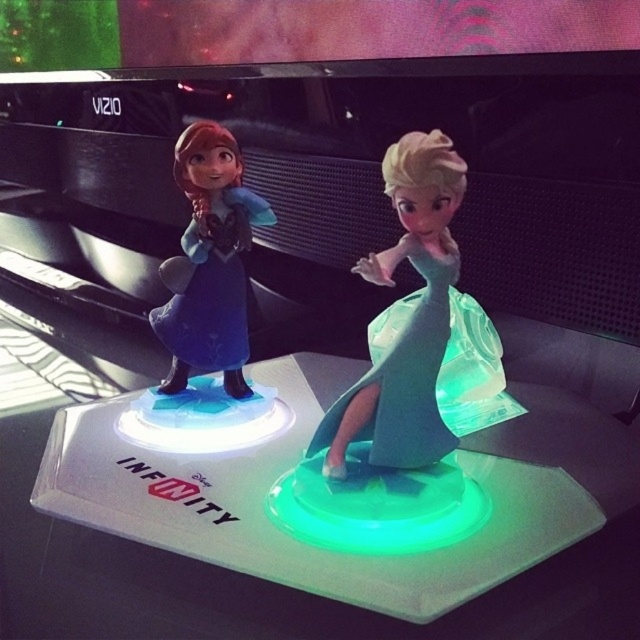
Who is more forward, [419,417] or [244,205]?

Point [419,417]

I want to click on translucent green dress at center, so click(404, 380).